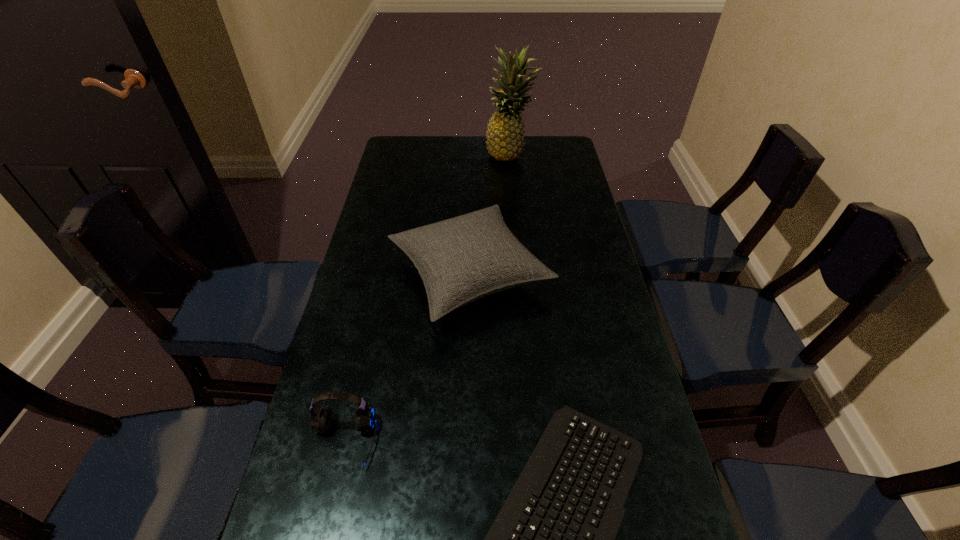
You are a GUI agent. You are given a task and a screenshot of the screen. Output one action in this format:
    pyautogui.click(x=<x>, y=<y>)
    Task: Click on the free space between the second shortest object and the tallest object
    
    Given the screenshot: What is the action you would take?
    pyautogui.click(x=426, y=299)

The height and width of the screenshot is (540, 960). What are the coordinates of `unoccupied area between the cushion and the third tallest object` in the screenshot? It's located at (407, 358).

Locate an element on the screen. The image size is (960, 540). the third closest object to the headset is located at coordinates (505, 137).

Locate an element on the screen. The width and height of the screenshot is (960, 540). object that stands as the third closest to the third shortest object is located at coordinates (505, 137).